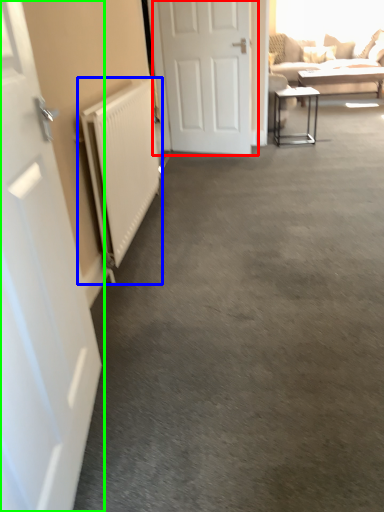
Question: Considering the real-world distances, which object is closest to door (highlighted by a red box)? radiator (highlighted by a blue box) or door (highlighted by a green box).

Choices:
 (A) radiator
 (B) door

Answer: (A)